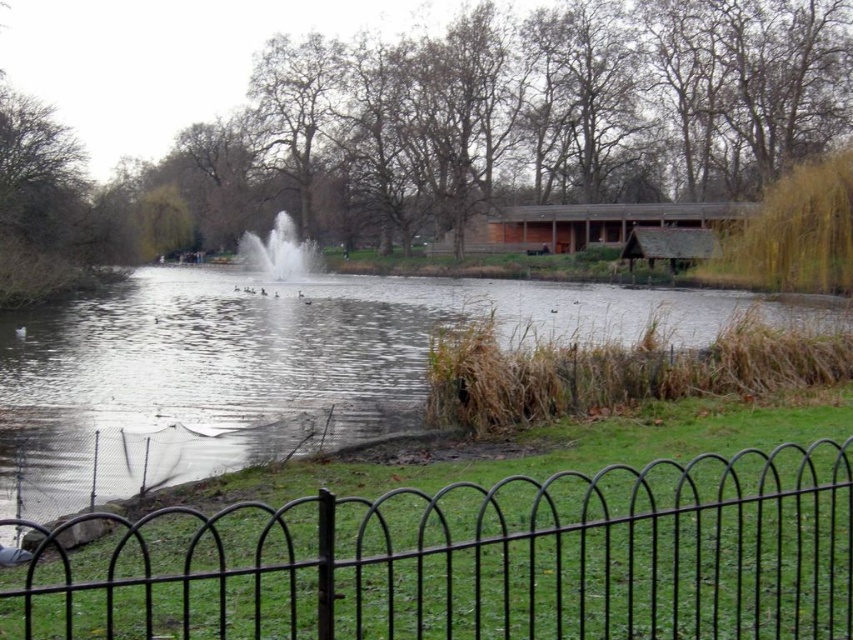
Looking at this image, who is positioned more to the right, black metal fence at lower center or clear water at center?

black metal fence at lower center is more to the right.

Is the position of black metal fence at lower center less distant than that of clear water at center?

Yes, black metal fence at lower center is closer to the viewer.

From the picture: Measure the distance between black metal fence at lower center and camera.

black metal fence at lower center and camera are 3.39 meters apart from each other.

Find the location of a particular element. black metal fence at lower center is located at coordinates (480, 561).

Is black metal fence at lower center to the left of white frothy water at center from the viewer's perspective?

No, black metal fence at lower center is not to the left of white frothy water at center.

Does black metal fence at lower center have a greater width compared to white frothy water at center?

No.

Between point (537, 557) and point (291, 248), which one is positioned behind?

The point (291, 248) is behind.

At what (x,y) coordinates should I click in order to perform the action: click on black metal fence at lower center. Please return your answer as a coordinate pair (x, y). This screenshot has width=853, height=640. Looking at the image, I should click on pos(480,561).

Between clear water at center and white frothy water at center, which one is positioned higher?

white frothy water at center is above.

Is point (575, 305) farther from camera compared to point (279, 259)?

No, (575, 305) is in front of (279, 259).

Locate an element on the screen. This screenshot has height=640, width=853. clear water at center is located at coordinates (270, 368).